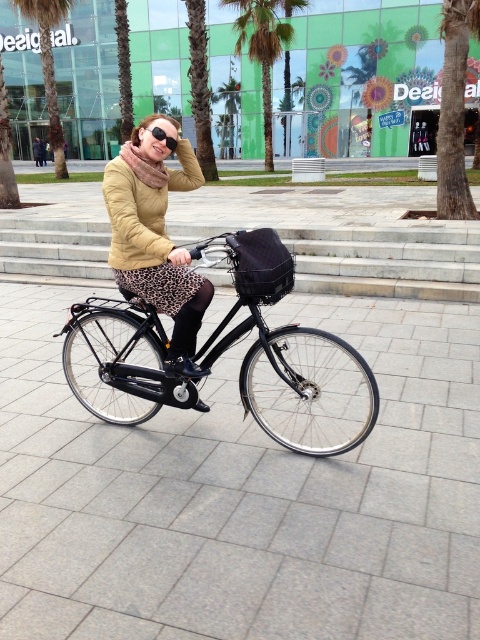
Question: Is the position of shiny black bicycle at center less distant than that of black matte goggles at upper center?

Choices:
 (A) yes
 (B) no

Answer: (A)

Question: Based on their relative distances, which object is farther from the black matte goggles at upper center?

Choices:
 (A) green leafy palm tree at center
 (B) shiny black bicycle at center

Answer: (A)

Question: Does shiny black bicycle at center appear on the left side of matte black jacket at center?

Choices:
 (A) no
 (B) yes

Answer: (A)

Question: Which object is the closest to the shiny black bicycle at center?

Choices:
 (A) green leafy palm tree at upper left
 (B) matte black jacket at center
 (C) green leafy palm tree at center
 (D) black matte goggles at upper center

Answer: (B)

Question: Which of the following is the closest to the observer?

Choices:
 (A) (139, 296)
 (B) (303, 337)
 (C) (175, 145)
 (D) (44, 61)

Answer: (B)

Question: Can you confirm if shiny black bicycle at center is wider than green leafy palm tree at upper left?

Choices:
 (A) yes
 (B) no

Answer: (B)